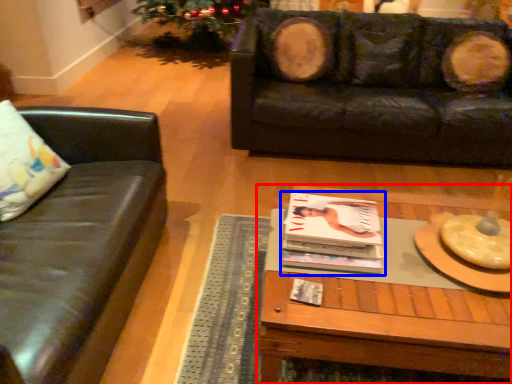
Question: Which of the following is the closest to the observer, coffee table (highlighted by a red box) or magazine (highlighted by a blue box)?

Choices:
 (A) coffee table
 (B) magazine

Answer: (A)